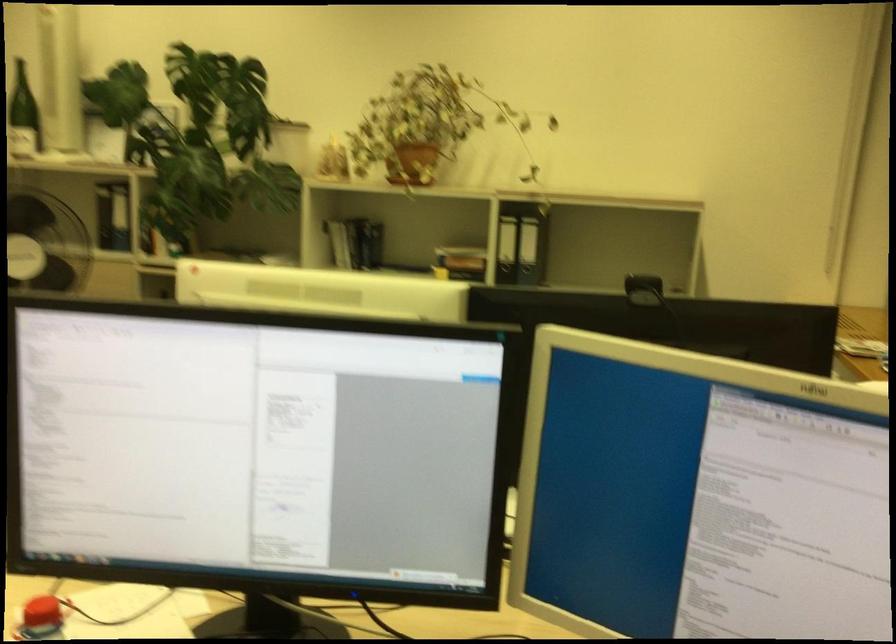
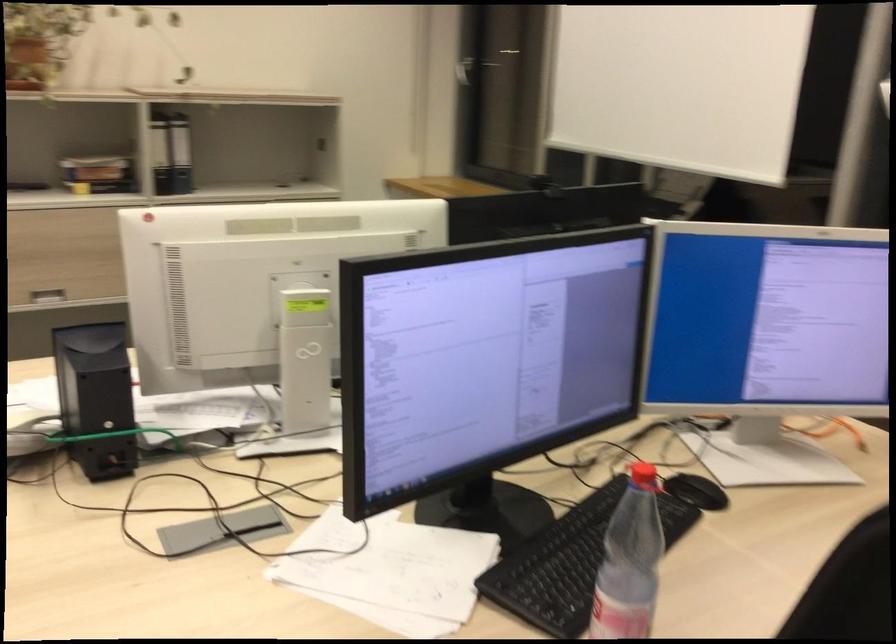
Where in the second image is the point corresponding to (460,265) from the first image?

(105, 175)